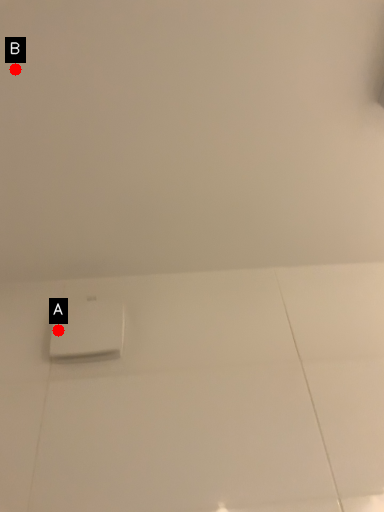
Question: Two points are circled on the image, labeled by A and B beside each circle. Which of the following is the closest to the observer?

Choices:
 (A) A is closer
 (B) B is closer

Answer: (B)